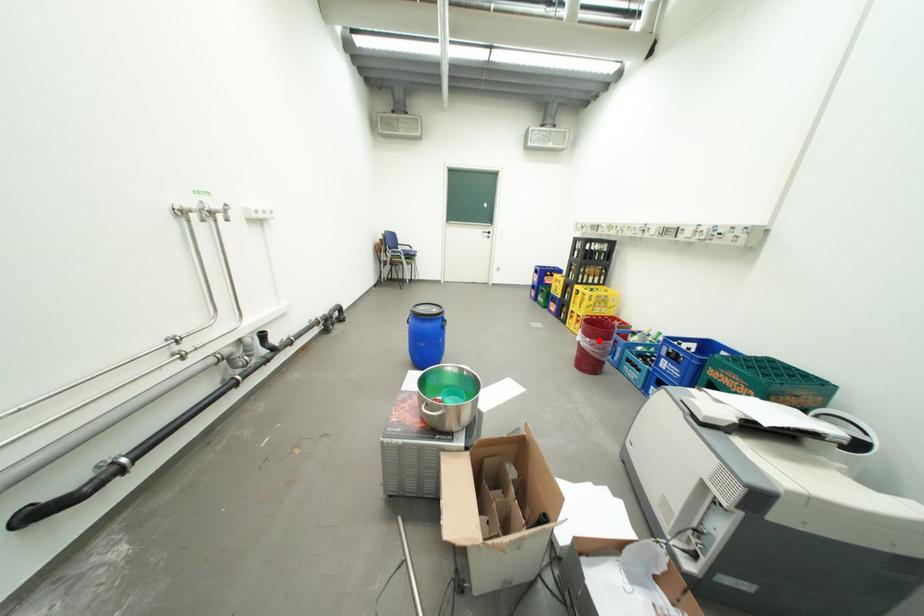
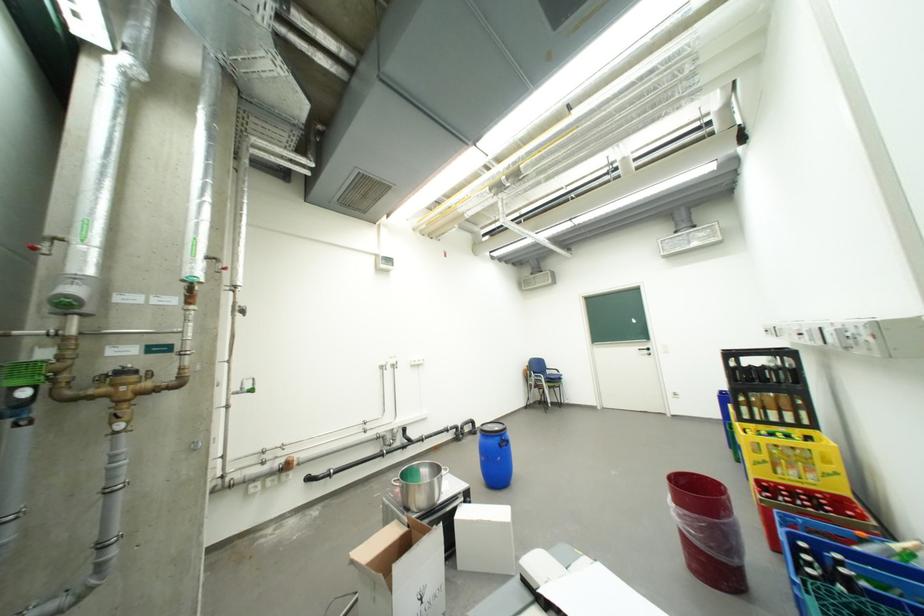
Question: A red point is marked in image1. In image2, is the corresponding 3D point closer to the camera or farther? Reply with the corresponding letter.

Choices:
 (A) The corresponding 3D point is closer.
 (B) The corresponding 3D point is farther.

Answer: (B)